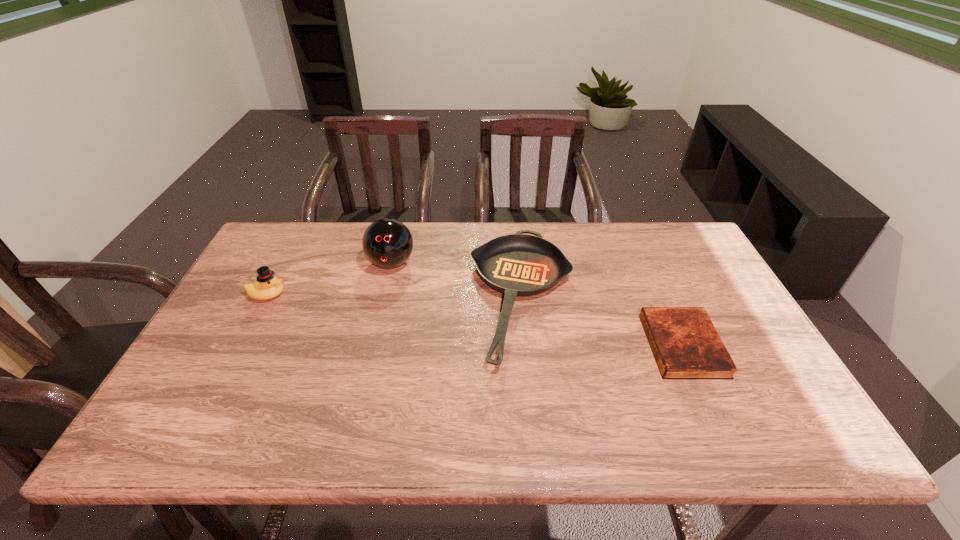
Identify the location of free space located 0.350m on the left of the third tallest object. This screenshot has width=960, height=540. (348, 297).

Locate an element on the screen. The image size is (960, 540). free space located 0.240m on the spine side of the shortest object is located at coordinates (556, 346).

Locate an element on the screen. The height and width of the screenshot is (540, 960). free point located 0.190m on the spine side of the shortest object is located at coordinates (575, 346).

I want to click on free region located on the spine side of the shortest object, so click(516, 346).

The width and height of the screenshot is (960, 540). In order to click on bowling ball present at the far edge in this screenshot , I will do `click(387, 243)`.

The width and height of the screenshot is (960, 540). I want to click on frying pan located in the far edge section of the desktop, so click(519, 264).

The height and width of the screenshot is (540, 960). What are the coordinates of `object located at the left edge` in the screenshot? It's located at (267, 286).

Find the location of `object present at the right edge`. object present at the right edge is located at coordinates (686, 345).

Where is `vacant space at the far edge of the desktop`? The image size is (960, 540). vacant space at the far edge of the desktop is located at coordinates (342, 263).

Locate an element on the screen. The width and height of the screenshot is (960, 540). free space at the near edge of the desktop is located at coordinates (423, 414).